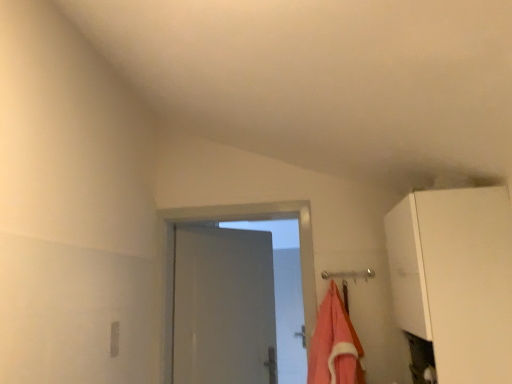
Question: From the image's perspective, relative to white matte cabinet at upper right, is orange cotton towel at center above or below?

Choices:
 (A) below
 (B) above

Answer: (A)

Question: Is orange cotton towel at center taller or shorter than white matte cabinet at upper right?

Choices:
 (A) tall
 (B) short

Answer: (B)

Question: Is point (335, 372) closer or farther from the camera than point (408, 304)?

Choices:
 (A) closer
 (B) farther

Answer: (B)

Question: Do you think white matte cabinet at upper right is within orange cotton towel at center, or outside of it?

Choices:
 (A) outside
 (B) inside

Answer: (A)

Question: Is point (449, 195) closer or farther from the camera than point (331, 317)?

Choices:
 (A) closer
 (B) farther

Answer: (A)

Question: Based on their sizes in the image, would you say white matte cabinet at upper right is bigger or smaller than orange cotton towel at center?

Choices:
 (A) small
 (B) big

Answer: (B)

Question: Is white matte cabinet at upper right taller or shorter than orange cotton towel at center?

Choices:
 (A) short
 (B) tall

Answer: (B)